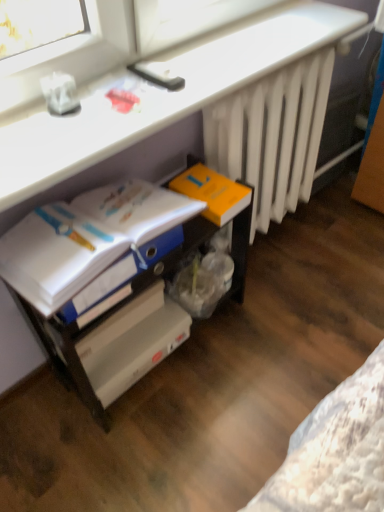
Identify the location of free space in front of white plastic file cabinet at lower center. Image resolution: width=384 pixels, height=512 pixels. (157, 445).